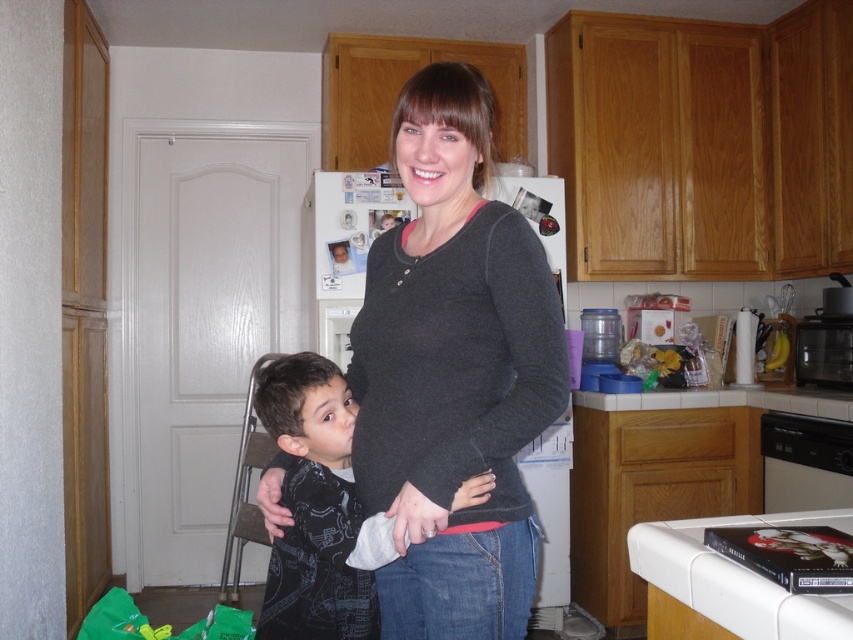
Can you confirm if dark gray sweater at center is wider than dark gray printed shirt at center?

Yes.

Is dark gray sweater at center to the right of dark gray printed shirt at center from the viewer's perspective?

Yes, dark gray sweater at center is to the right of dark gray printed shirt at center.

Identify the location of dark gray sweater at center. This screenshot has width=853, height=640. click(453, 372).